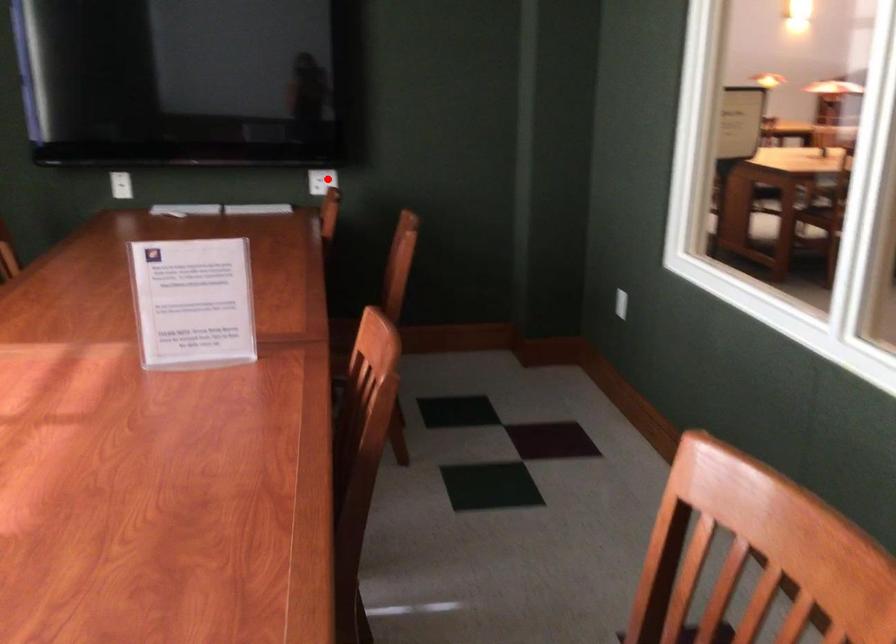
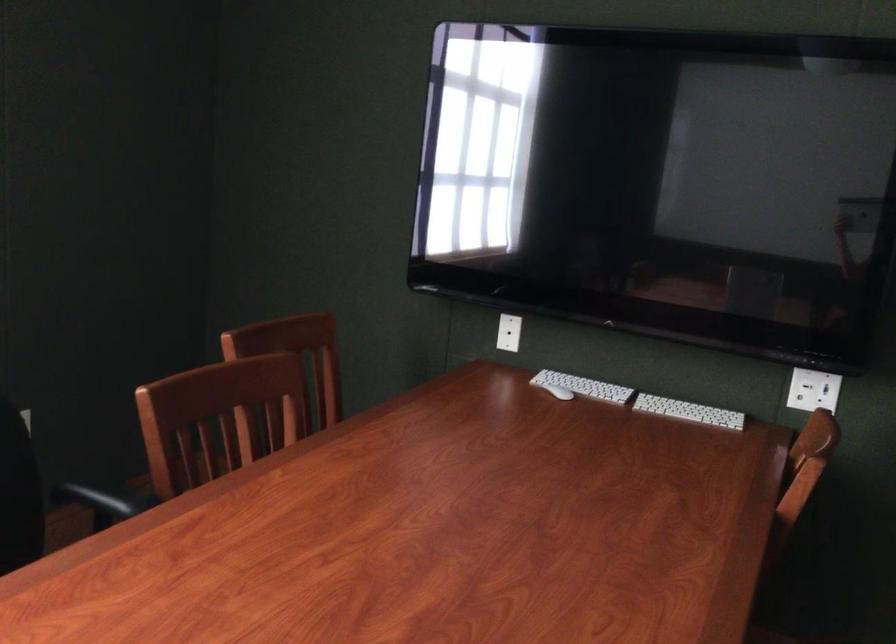
Question: I am providing you with two images of the same scene from different viewpoints. Image1 has a red point marked. In image2, the corresponding 3D location appears at what relative position? Reply with the corresponding letter.

Choices:
 (A) Closer
 (B) Farther

Answer: (A)